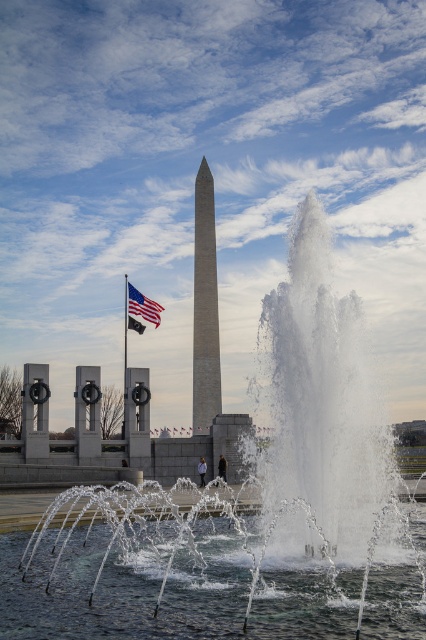
Can you confirm if white water at center is shorter than smooth gray obelisk at center?

Indeed, white water at center has a lesser height compared to smooth gray obelisk at center.

Between white water at center and smooth gray obelisk at center, which one appears on the right side from the viewer's perspective?

white water at center is more to the right.

I want to click on white water at center, so 245,512.

Who is higher up, clear water at center or american flag at center?

Positioned higher is american flag at center.

Can you confirm if clear water at center is shorter than american flag at center?

Indeed, clear water at center has a lesser height compared to american flag at center.

Does point (299, 608) come in front of point (138, 301)?

Yes, it is.

Where is `clear water at center`? clear water at center is located at coordinates (169, 586).

At what (x,y) coordinates should I click in order to perform the action: click on clear water at center. Please return your answer as a coordinate pair (x, y). The image size is (426, 640). Looking at the image, I should click on pos(169,586).

Can you confirm if clear water at center is positioned to the right of smooth gray obelisk at center?

Indeed, clear water at center is positioned on the right side of smooth gray obelisk at center.

This screenshot has height=640, width=426. Identify the location of clear water at center. (169, 586).